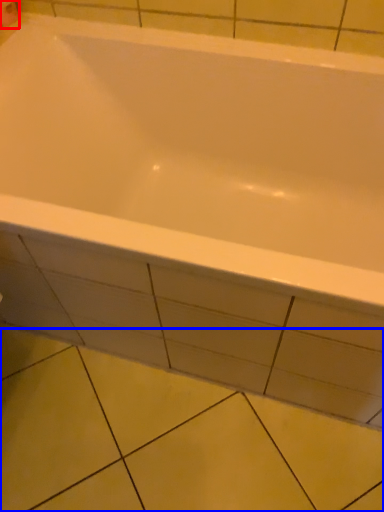
Question: Which object appears farthest to the camera in this image, toilet paper (highlighted by a red box) or ceramic tile (highlighted by a blue box)?

Choices:
 (A) toilet paper
 (B) ceramic tile

Answer: (A)